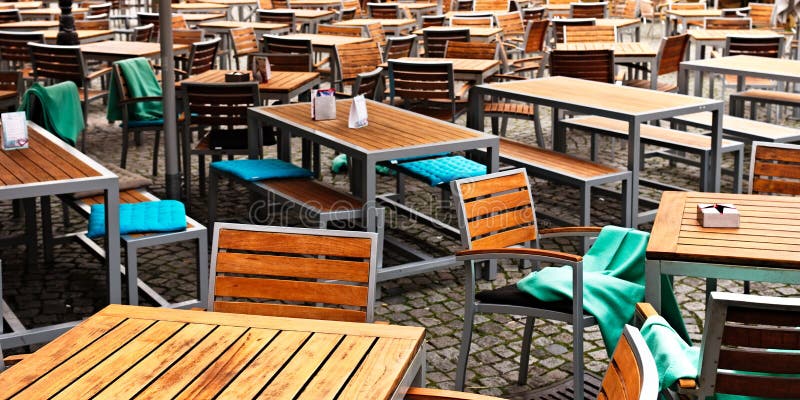
Identify the location of green towels. (60, 124), (137, 83), (592, 288), (665, 363), (338, 166).